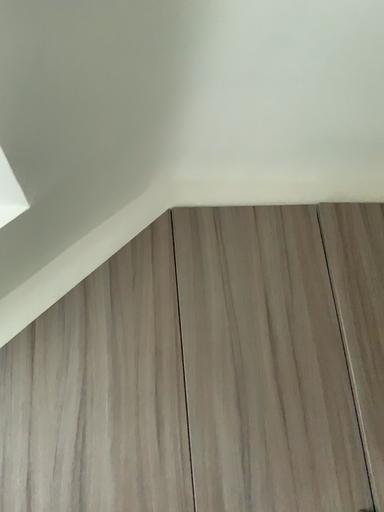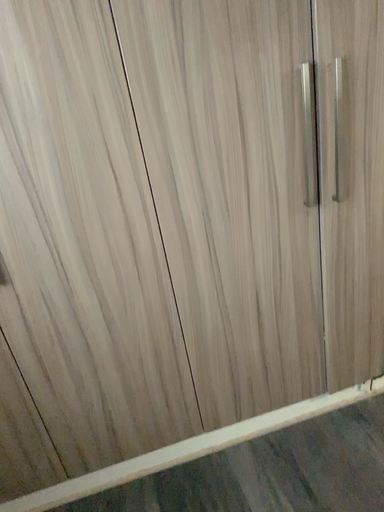
Question: Which way did the camera rotate in the video?

Choices:
 (A) rotated left
 (B) rotated right

Answer: (B)